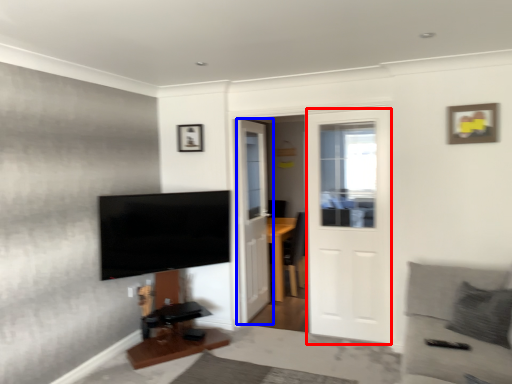
Question: Among these objects, which one is nearest to the camera, door (highlighted by a red box) or door (highlighted by a blue box)?

Choices:
 (A) door
 (B) door

Answer: (A)